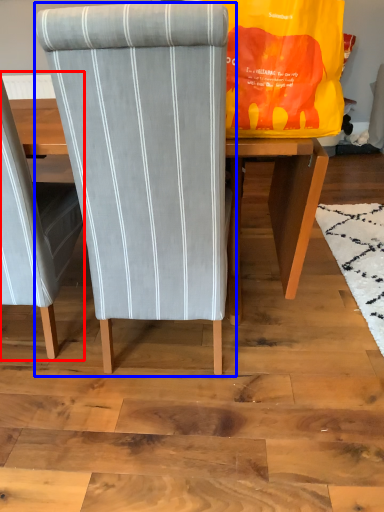
Question: Among these objects, which one is farthest to the camera, chair (highlighted by a red box) or chair (highlighted by a blue box)?

Choices:
 (A) chair
 (B) chair

Answer: (A)